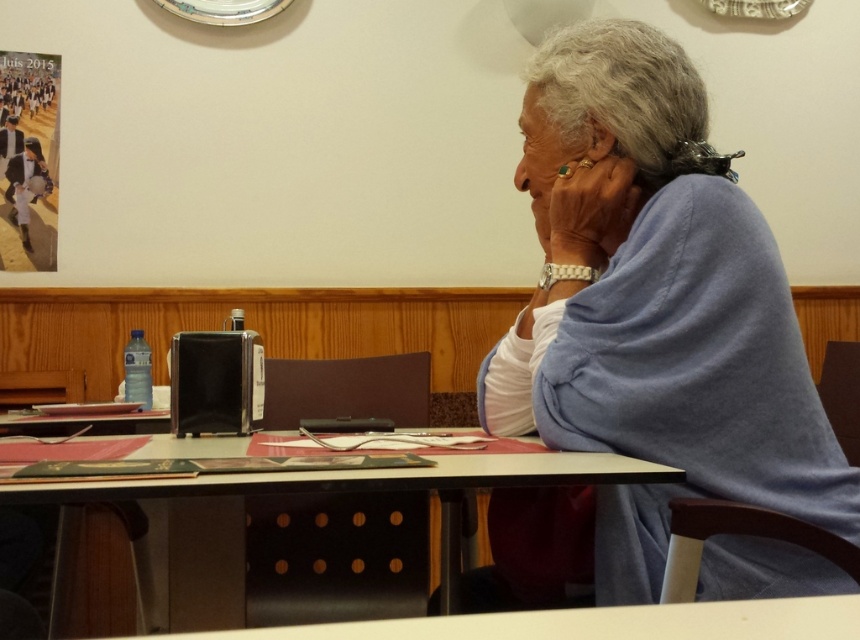
Question: Does blue fabric at upper right have a larger size compared to black plastic table at center?

Choices:
 (A) no
 (B) yes

Answer: (A)

Question: Among these objects, which one is nearest to the camera?

Choices:
 (A) blue fabric at upper right
 (B) black plastic table at center

Answer: (B)

Question: Can you confirm if blue fabric at upper right is smaller than black plastic table at center?

Choices:
 (A) yes
 (B) no

Answer: (A)

Question: Among these points, which one is farthest from the camera?

Choices:
 (A) (580, 97)
 (B) (69, 499)

Answer: (A)

Question: Observing the image, what is the correct spatial positioning of blue fabric at upper right in reference to black plastic table at center?

Choices:
 (A) right
 (B) left

Answer: (A)

Question: Which object is farther from the camera taking this photo?

Choices:
 (A) blue fabric at upper right
 (B) black plastic table at center

Answer: (A)